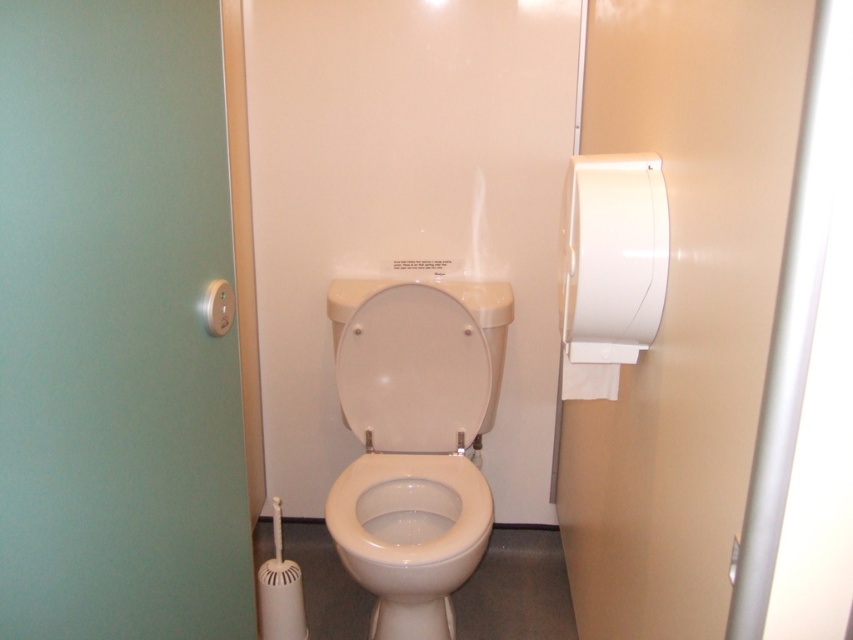
Question: Which of the following is the closest to the observer?

Choices:
 (A) white glossy toilet bowl at center
 (B) white glossy toilet at center
 (C) white glossy toilet lid at center

Answer: (A)

Question: Which point appears farthest from the camera in this image?

Choices:
 (A) (589, 221)
 (B) (399, 426)

Answer: (B)

Question: Which object appears closest to the camera in this image?

Choices:
 (A) white glossy toilet lid at center
 (B) white glossy toilet bowl at center
 (C) white glossy toilet at center

Answer: (B)

Question: Observing the image, what is the correct spatial positioning of white glossy toilet lid at center in reference to white glossy toilet bowl at center?

Choices:
 (A) left
 (B) right

Answer: (A)

Question: Observing the image, what is the correct spatial positioning of white glossy toilet lid at center in reference to white matte toilet paper at right?

Choices:
 (A) above
 (B) below

Answer: (B)

Question: Does white glossy toilet bowl at center appear over white matte toilet paper at right?

Choices:
 (A) yes
 (B) no

Answer: (B)